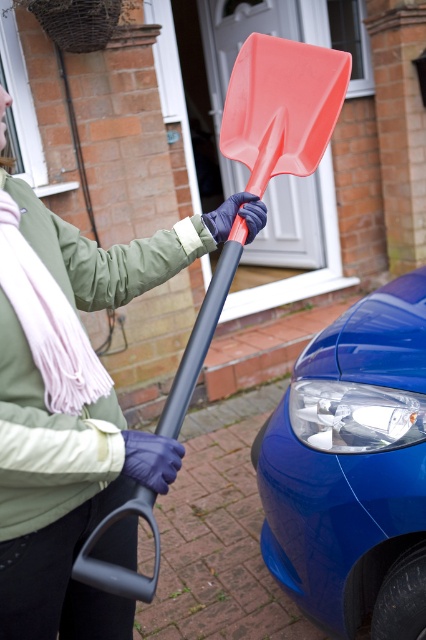
Can you confirm if glossy blue car at lower right is thinner than rubberized plastic shovel at center?

No.

Which is in front, point (368, 340) or point (316, 93)?

Point (316, 93) is more forward.

Identify the location of glossy blue car at lower right. The height and width of the screenshot is (640, 426). (351, 468).